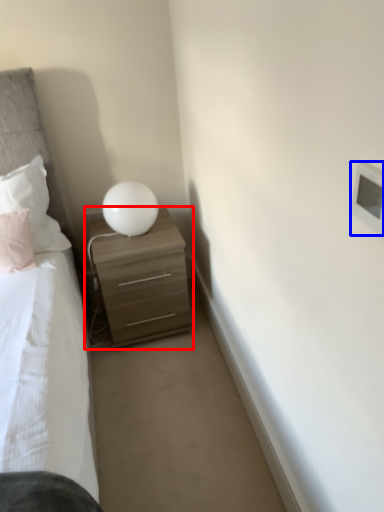
Question: Which point is closer to the camera, nightstand (highlighted by a red box) or light switch (highlighted by a blue box)?

Choices:
 (A) nightstand
 (B) light switch

Answer: (B)